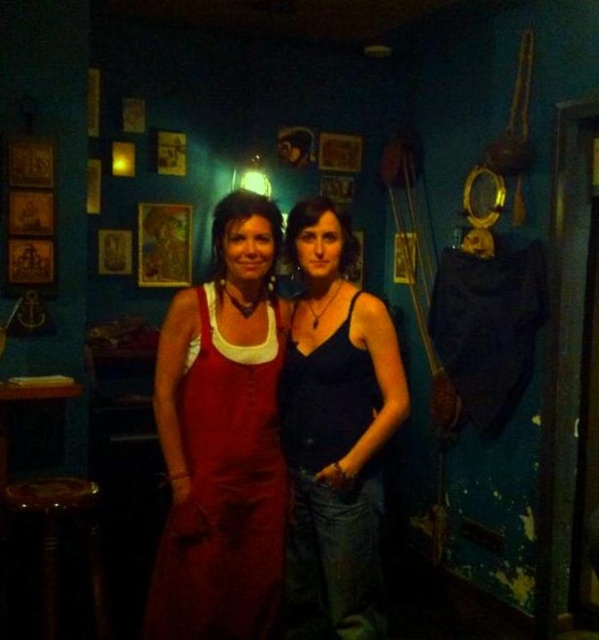
Question: Where is matte blue tank top at center located in relation to wooden stool at lower left in the image?

Choices:
 (A) right
 (B) left

Answer: (A)

Question: Which of the following is the farthest from the observer?

Choices:
 (A) (52, 532)
 (B) (156, 416)

Answer: (A)

Question: Can you confirm if matte blue tank top at center is smaller than wooden stool at lower left?

Choices:
 (A) yes
 (B) no

Answer: (B)

Question: Does matte red dress at center have a smaller size compared to wooden stool at lower left?

Choices:
 (A) no
 (B) yes

Answer: (B)

Question: Which point is farther from the camera taking this photo?

Choices:
 (A) (165, 540)
 (B) (403, 371)

Answer: (B)

Question: Based on their relative distances, which object is farther from the matte blue tank top at center?

Choices:
 (A) wooden stool at lower left
 (B) matte red dress at center

Answer: (A)